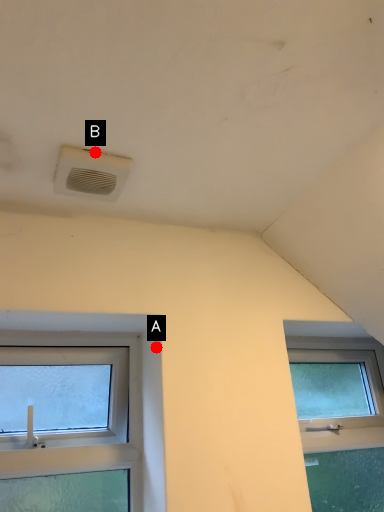
Question: Two points are circled on the image, labeled by A and B beside each circle. Which point is further to the camera?

Choices:
 (A) A is further
 (B) B is further

Answer: (A)